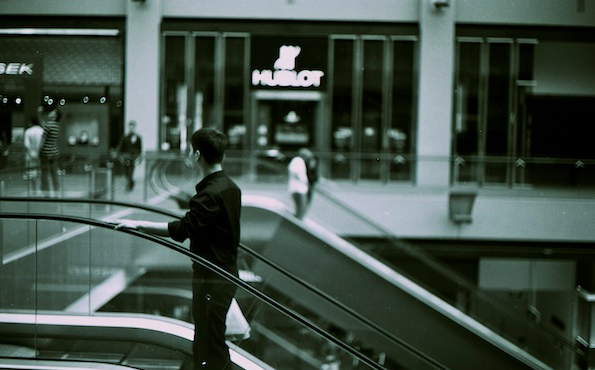
The image size is (595, 370). In order to click on handrail in this screenshot , I will do `click(256, 294)`, `click(263, 259)`, `click(388, 234)`.